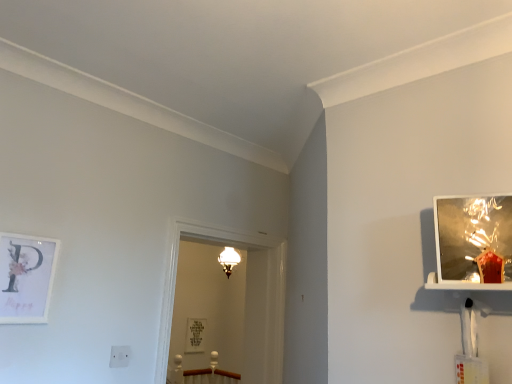
Question: Would you say matte white sconce at upper center is inside or outside metallic reflective picture frame at upper right, positioned as the 3th picture frame in back-to-front order?

Choices:
 (A) inside
 (B) outside

Answer: (B)

Question: Looking at their shapes, would you say matte white sconce at upper center is wider or thinner than metallic reflective picture frame at upper right, which appears as the 1th picture frame when viewed from the top?

Choices:
 (A) thin
 (B) wide

Answer: (B)

Question: Estimate the real-world distances between objects in this image. Which object is closer to the metallic reflective picture frame at upper right, positioned as the 3th picture frame in back-to-front order?

Choices:
 (A) matte white sconce at upper center
 (B) white matte picture frame at left, which ranks as the third picture frame in right-to-left order
 (C) clear glass door at center
 (D) matte silver picture frame at center, which appears as the 2th picture frame when viewed from the left

Answer: (C)

Question: Estimate the real-world distances between objects in this image. Which object is closer to the matte white sconce at upper center?

Choices:
 (A) clear glass door at center
 (B) matte silver picture frame at center, the third picture frame positioned from the top
 (C) metallic reflective picture frame at upper right, which ranks as the 3th picture frame in left-to-right order
 (D) white matte picture frame at left, the 2th picture frame in the bottom-to-top sequence

Answer: (A)